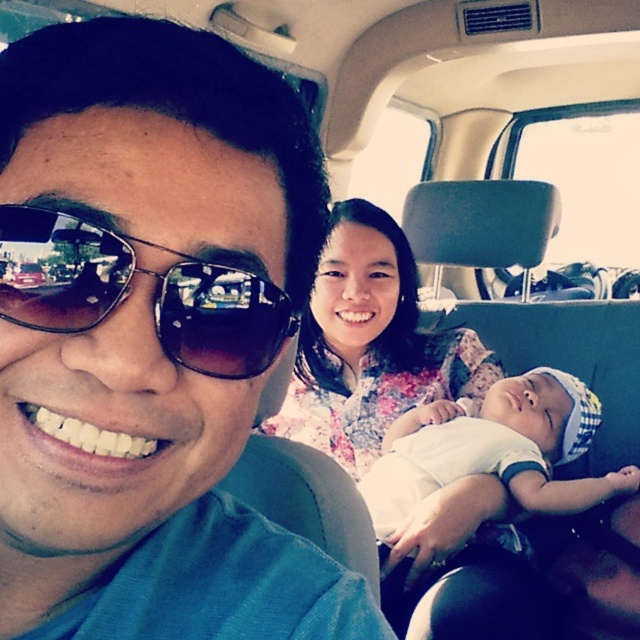
You are a photographer trying to capture a clear shot of the floral fabric dress at center and the sunglasses at left. Which object is closer to the camera?

The floral fabric dress at center is closer to the camera than the sunglasses at left because the sunglasses at left is behind it.

You are sitting in the car and want to reach both the point at coordinates point [362,225] and the point at coordinates point [67,243]. Which point is farther away from you?

The point at coordinates point [362,225] is farther away because it is behind point [67,243].